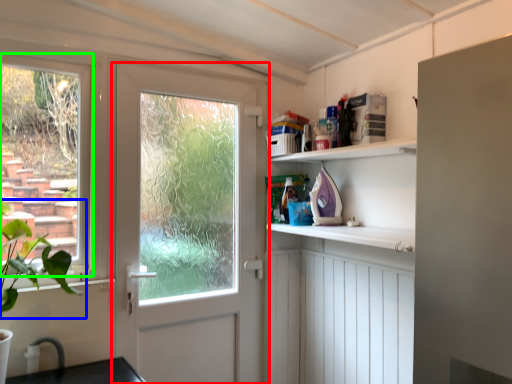
Question: Estimate the real-world distances between objects in this image. Which object is farther from door (highlighted by a red box), plant (highlighted by a blue box) or window (highlighted by a green box)?

Choices:
 (A) plant
 (B) window

Answer: (A)